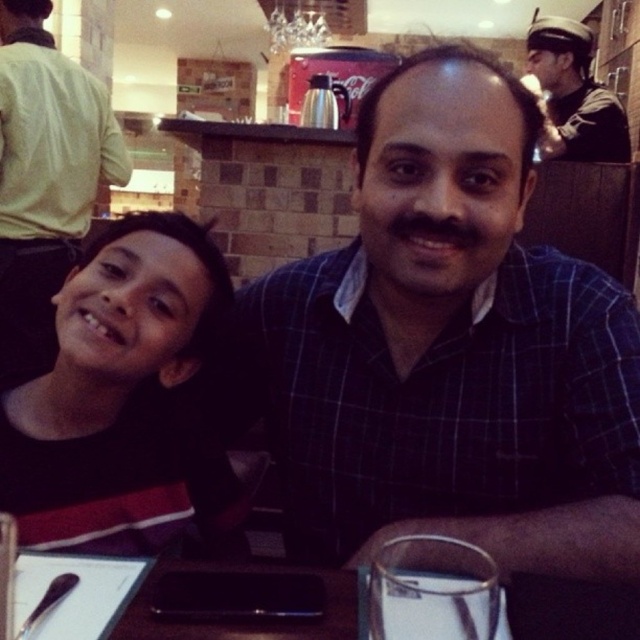
You are sitting at the table in the image and want to reach for the object at point [52,122]. Is this point closer to you than the object at point [572,54]?

Yes, the point [52,122] is closer to you than the point [572,54] because it is in front of it.

You are a photographer setting up for a family photo. You notice two shirts on the left side of the scene. Which one is positioned more to the right between the black fabric shirt at left and the matte black shirt at left?

The black fabric shirt at left is positioned more to the right compared to the matte black shirt at left.

You are trying to decide which shirt to wear for a casual day out. You see both the black fabric shirt at left and the matte black shirt at left in your closet. Which one is shorter?

The black fabric shirt at left is shorter than the matte black shirt at left, so you should choose the black fabric shirt at left if you prefer a shorter length.